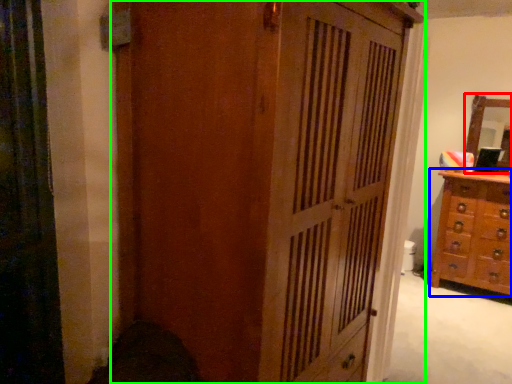
Question: Considering the real-world distances, which object is closest to mirror (highlighted by a red box)? chest of drawers (highlighted by a blue box) or cupboard (highlighted by a green box).

Choices:
 (A) chest of drawers
 (B) cupboard

Answer: (A)